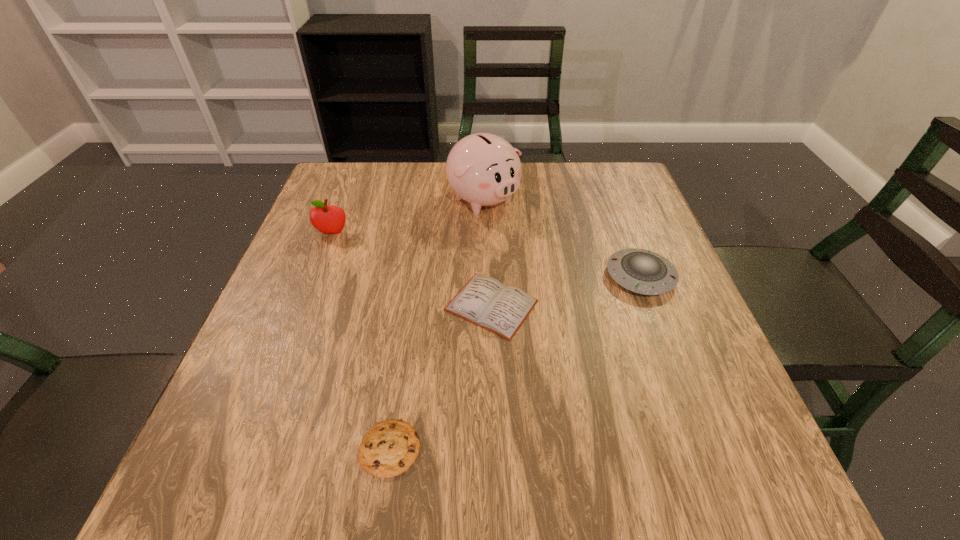
Find the location of a particular element. The image size is (960, 540). vacant space located on the back of the second tallest object is located at coordinates pos(343,206).

You are a GUI agent. You are given a task and a screenshot of the screen. Output one action in this format:
    pyautogui.click(x=<x>, y=<y>)
    Task: Click on the free region located on the left of the saucer
    
    Given the screenshot: What is the action you would take?
    pyautogui.click(x=488, y=276)

At what (x,y) coordinates should I click in order to perform the action: click on vacant area situated on the right of the diary. Please return your answer as a coordinate pair (x, y). The image size is (960, 540). Looking at the image, I should click on (597, 305).

At what (x,y) coordinates should I click in order to perform the action: click on free location located on the right of the cookie. Please return your answer as a coordinate pair (x, y). The image size is (960, 540). Looking at the image, I should click on (599, 449).

Identify the location of object that is at the far edge. The image size is (960, 540). (483, 169).

Where is `object positioned at the near edge`? The image size is (960, 540). object positioned at the near edge is located at coordinates (390, 448).

This screenshot has width=960, height=540. Find the location of `object that is at the left edge`. object that is at the left edge is located at coordinates pyautogui.click(x=330, y=219).

Find the location of a particular element. The height and width of the screenshot is (540, 960). object that is at the right edge is located at coordinates (641, 271).

Where is `vacant space at the far edge`? The image size is (960, 540). vacant space at the far edge is located at coordinates (535, 186).

Locate an element on the screen. free space at the near edge of the desktop is located at coordinates (450, 492).